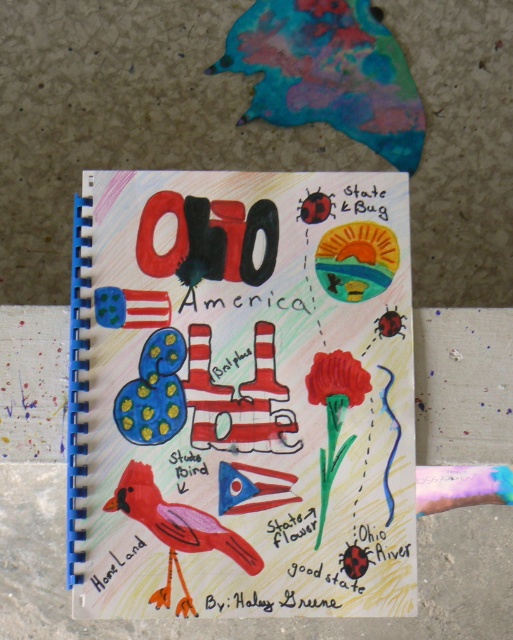
You are an artist who wants to place a matte red flower at center on top of the colored paper notebook at center. Based on their sizes, will the flower fit entirely on the notebook?

The colored paper notebook at center has a greater height compared to matte red flower at center. Since the notebook is taller, the flower will fit entirely on the notebook as long as its width also accommodates it, but the description only mentions height. However, without width information, we can only confirm the vertical fit.

You are designing a sticker to place on the notebook page. The sticker must fit between the smooth pink bird at center and the white paper at lower left without overlapping either. What is the maximum width your sticker can be?

The smooth pink bird at center is 0.90 inches away from the white paper at lower left. To avoid overlapping, the sticker must be smaller than 0.90 inches in width.

You are an artist trying to draw the scene exactly as shown. You have a small white paper at lower left and a smooth pink bird at center. Which object should you draw first if you want to follow the size order from largest to smallest?

You should draw the smooth pink bird at center first because it is bigger than the white paper at lower left.